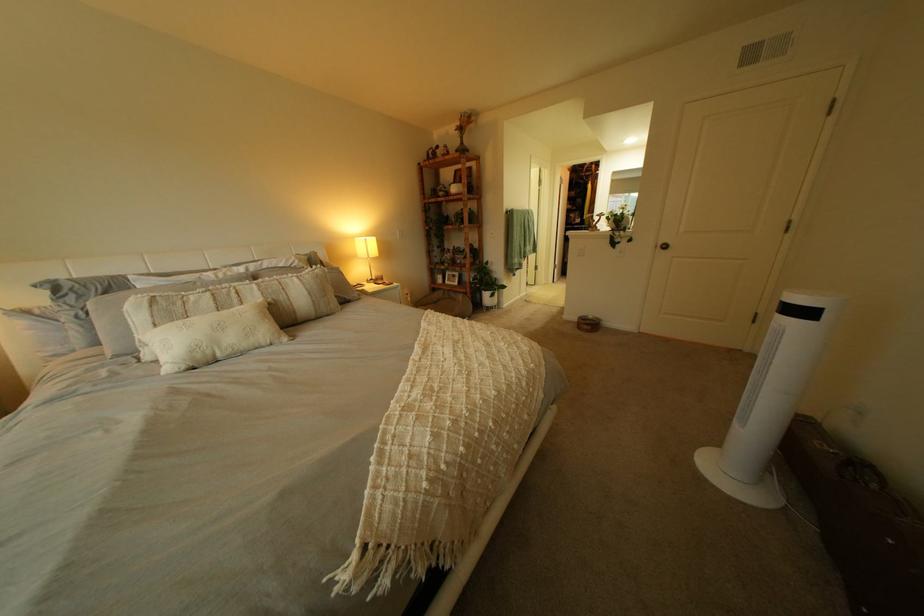
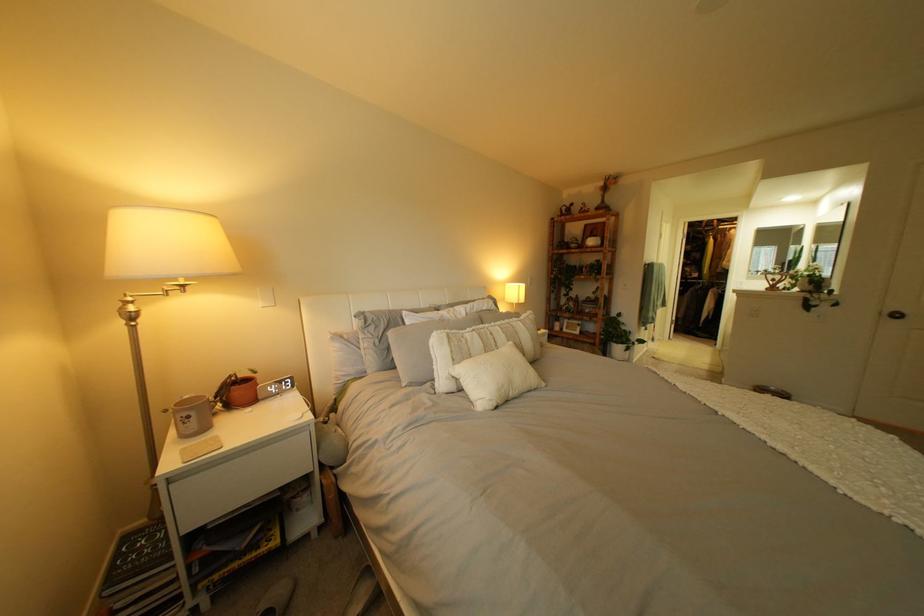
Question: In a continuous first-person perspective shot, in which direction is the camera moving?

Choices:
 (A) Left
 (B) Right
 (C) Forward
 (D) Backward

Answer: (A)